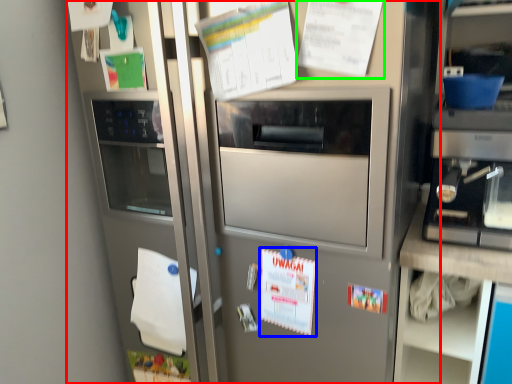
Question: Which is nearer to the fridge (highlighted by a red box)? poster (highlighted by a blue box) or poster (highlighted by a green box).

Choices:
 (A) poster
 (B) poster

Answer: (A)